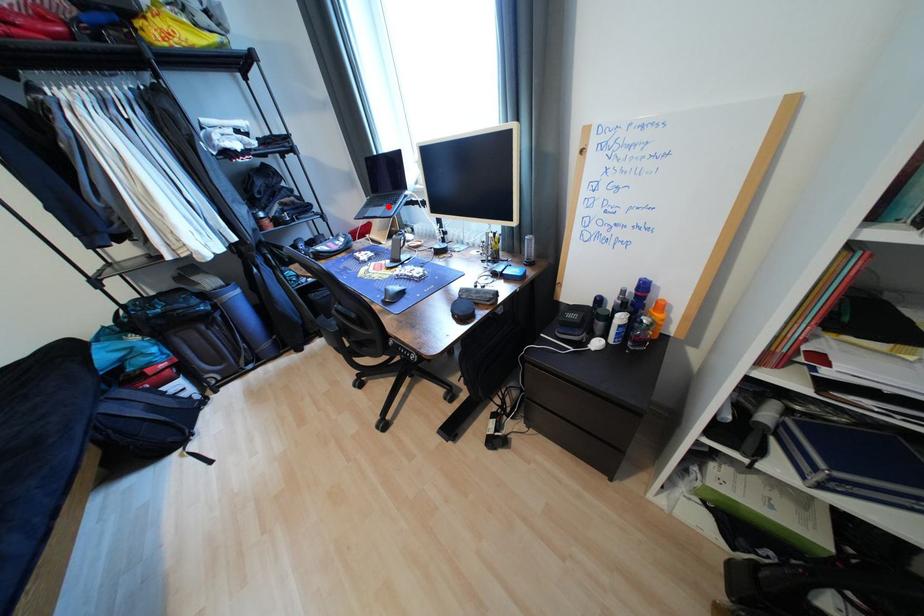
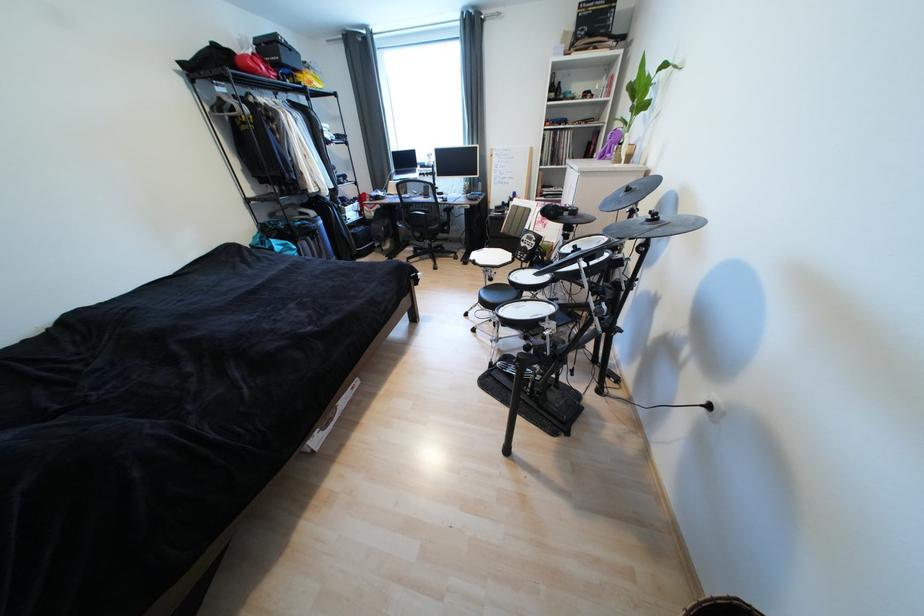
Question: I am providing you with two images of the same scene from different viewpoints. A red point is marked on the first image. Can you still see the location of the red point in image 2?

Choices:
 (A) Yes
 (B) No

Answer: (B)